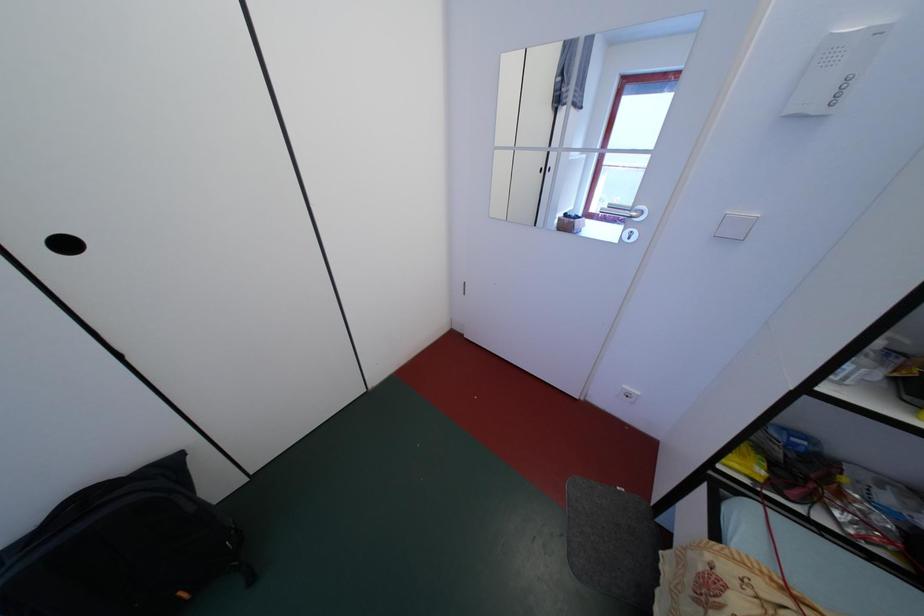
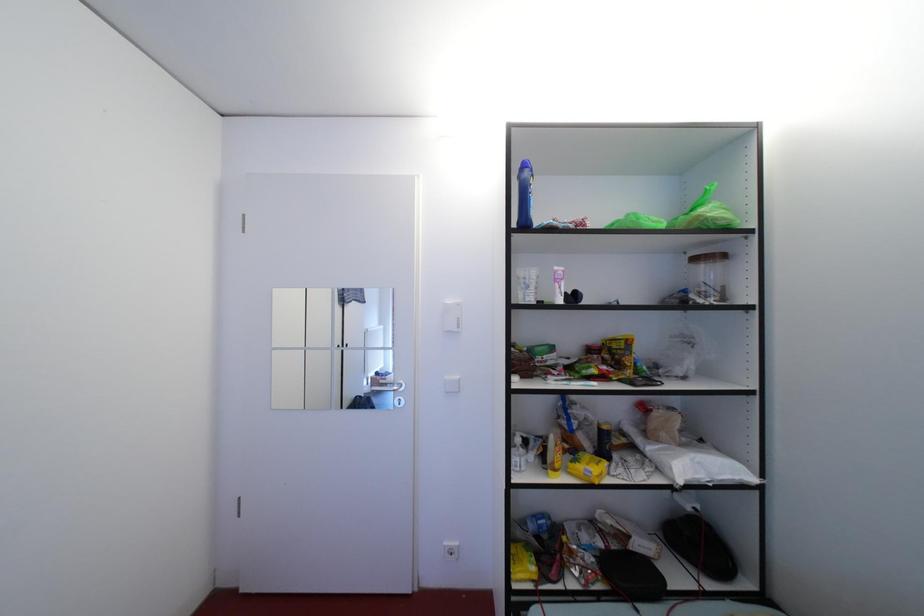
The first image is from the beginning of the video and the second image is from the end. How did the camera likely rotate when shooting the video?

The camera rotated toward right-up.